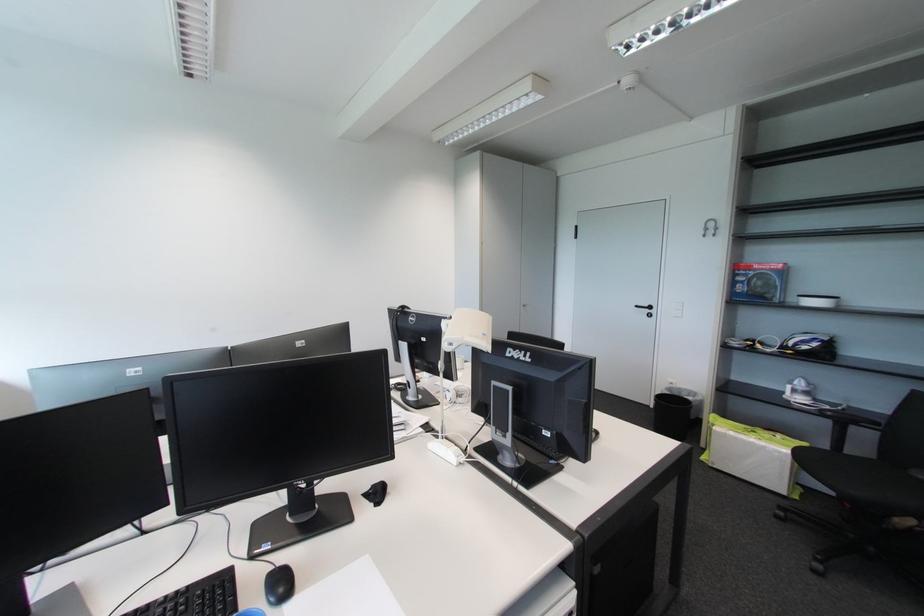
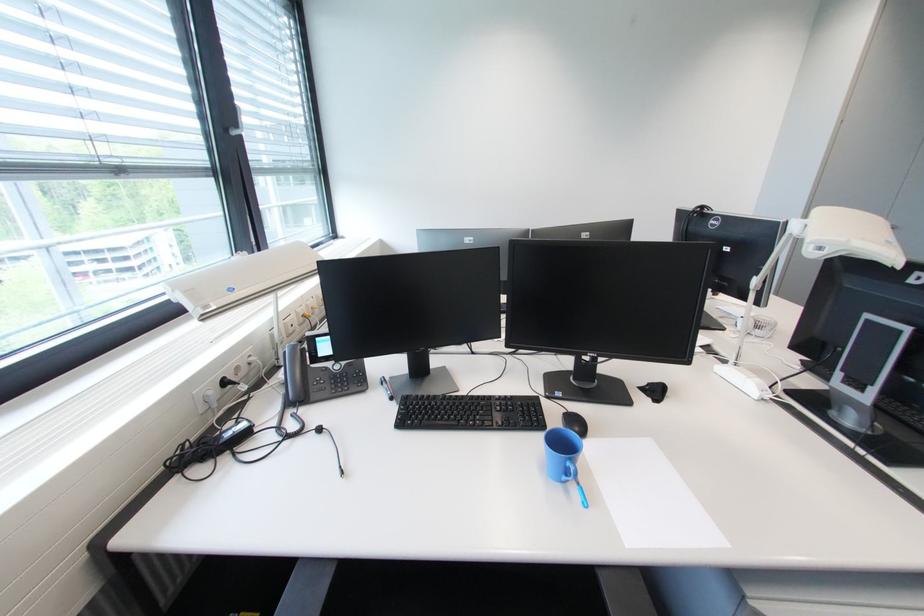
The point at [379,488] is marked in the first image. Where is the corresponding point in the second image?

(655, 386)